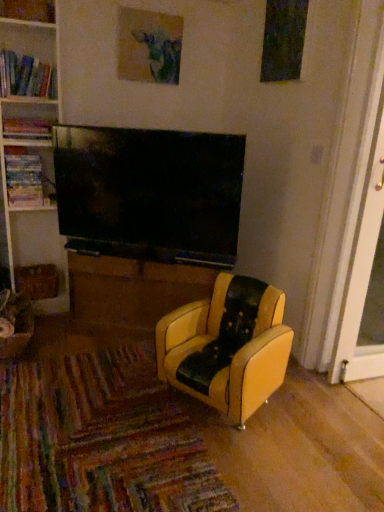
Question: Does hardcover books at left, which ranks as the first book in top-to-bottom order, have a greater height compared to white plastic screen door at right?

Choices:
 (A) yes
 (B) no

Answer: (B)

Question: Is hardcover books at left, the 3th book positioned from the bottom, positioned with its back to white plastic screen door at right?

Choices:
 (A) no
 (B) yes

Answer: (A)

Question: Is hardcover books at left, which ranks as the first book in top-to-bottom order, bigger than white plastic screen door at right?

Choices:
 (A) yes
 (B) no

Answer: (B)

Question: Considering the relative sizes of hardcover books at left, the 3th book positioned from the bottom, and white plastic screen door at right in the image provided, is hardcover books at left, the 3th book positioned from the bottom, wider than white plastic screen door at right?

Choices:
 (A) yes
 (B) no

Answer: (B)

Question: Is hardcover books at left, which ranks as the first book in top-to-bottom order, positioned before white plastic screen door at right?

Choices:
 (A) no
 (B) yes

Answer: (B)

Question: Relative to matte paper picture frame at upper center, is hardcover books at left, which ranks as the first book in top-to-bottom order, in front or behind?

Choices:
 (A) front
 (B) behind

Answer: (A)

Question: From the image's perspective, is hardcover books at left, which ranks as the first book in top-to-bottom order, above or below matte paper picture frame at upper center?

Choices:
 (A) above
 (B) below

Answer: (B)

Question: In terms of height, does hardcover books at left, which ranks as the first book in top-to-bottom order, look taller or shorter compared to matte paper picture frame at upper center?

Choices:
 (A) tall
 (B) short

Answer: (B)

Question: From a real-world perspective, is hardcover books at left, the 3th book positioned from the bottom, physically located above or below matte paper picture frame at upper center?

Choices:
 (A) above
 (B) below

Answer: (B)

Question: In terms of height, does hardcover book at left, marked as the 2th book in a top-to-bottom arrangement, look taller or shorter compared to yellow leather chair at center?

Choices:
 (A) short
 (B) tall

Answer: (A)

Question: Is hardcover book at left, marked as the 2th book in a top-to-bottom arrangement, inside or outside of yellow leather chair at center?

Choices:
 (A) outside
 (B) inside

Answer: (A)

Question: In terms of width, does hardcover book at left, marked as the 2th book in a top-to-bottom arrangement, look wider or thinner when compared to yellow leather chair at center?

Choices:
 (A) thin
 (B) wide

Answer: (A)

Question: Considering their positions, is hardcover book at left, marked as the 2th book in a top-to-bottom arrangement, located in front of or behind yellow leather chair at center?

Choices:
 (A) front
 (B) behind

Answer: (B)

Question: Is brown wood table at center taller or shorter than wooden bookshelf at upper left?

Choices:
 (A) tall
 (B) short

Answer: (A)

Question: Based on their positions, is brown wood table at center located to the left or right of wooden bookshelf at upper left?

Choices:
 (A) left
 (B) right

Answer: (B)